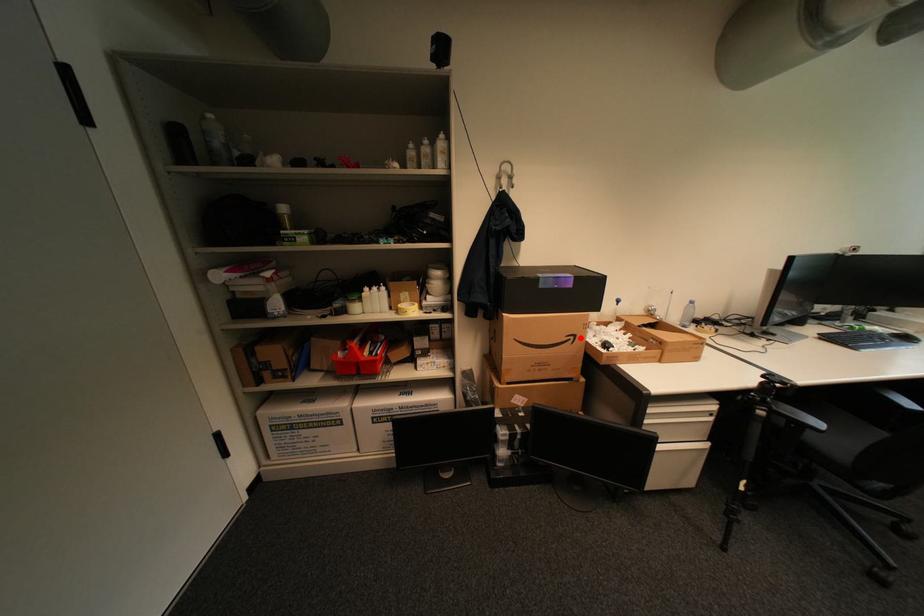
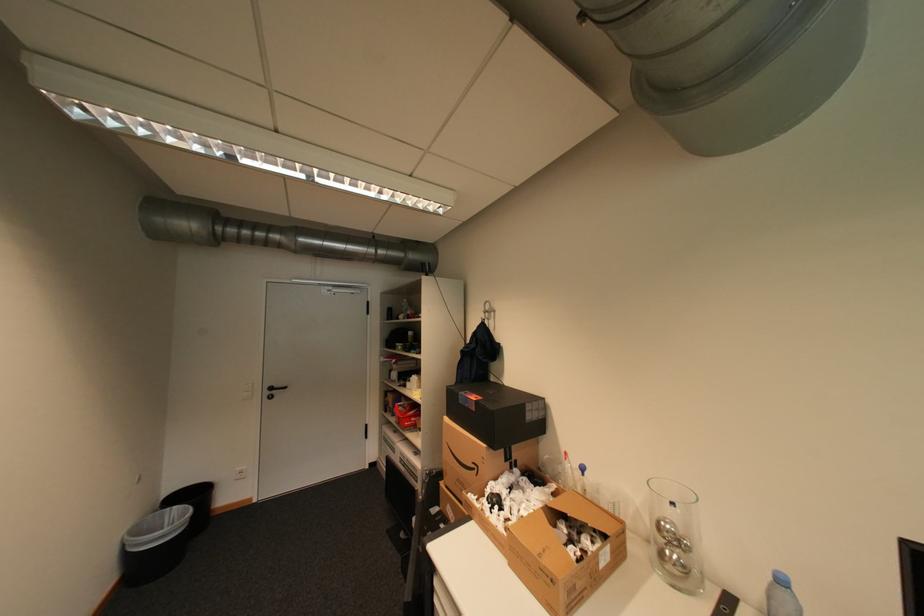
Question: I am providing you with two images of the same scene from different viewpoints. A red point is shown in image1. For the corresponding object point in image2, is it positioned nearer or farther from the camera?

Choices:
 (A) Nearer
 (B) Farther

Answer: (B)